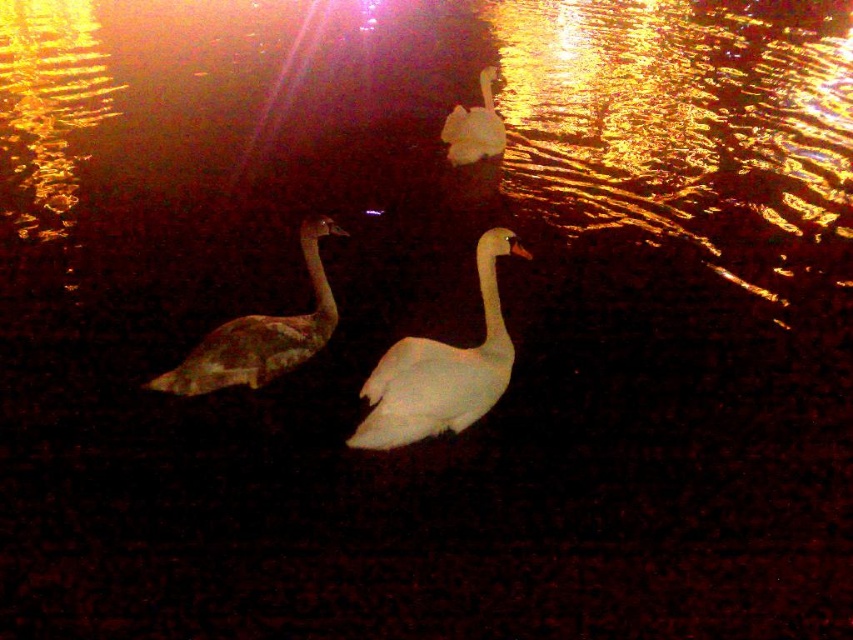
Question: Which point is farther to the camera?

Choices:
 (A) (427, 413)
 (B) (315, 300)

Answer: (B)

Question: Is brown speckled goose at left closer to camera compared to white glossy swan at upper center?

Choices:
 (A) no
 (B) yes

Answer: (B)

Question: Which point appears farthest from the camera in this image?

Choices:
 (A) (418, 412)
 (B) (297, 330)

Answer: (B)

Question: Is white glossy swan at center positioned at the back of white glossy swan at upper center?

Choices:
 (A) yes
 (B) no

Answer: (B)

Question: Which point is closer to the camera?

Choices:
 (A) (431, 406)
 (B) (488, 77)

Answer: (A)

Question: Is brown speckled goose at left closer to camera compared to white glossy swan at upper center?

Choices:
 (A) yes
 (B) no

Answer: (A)